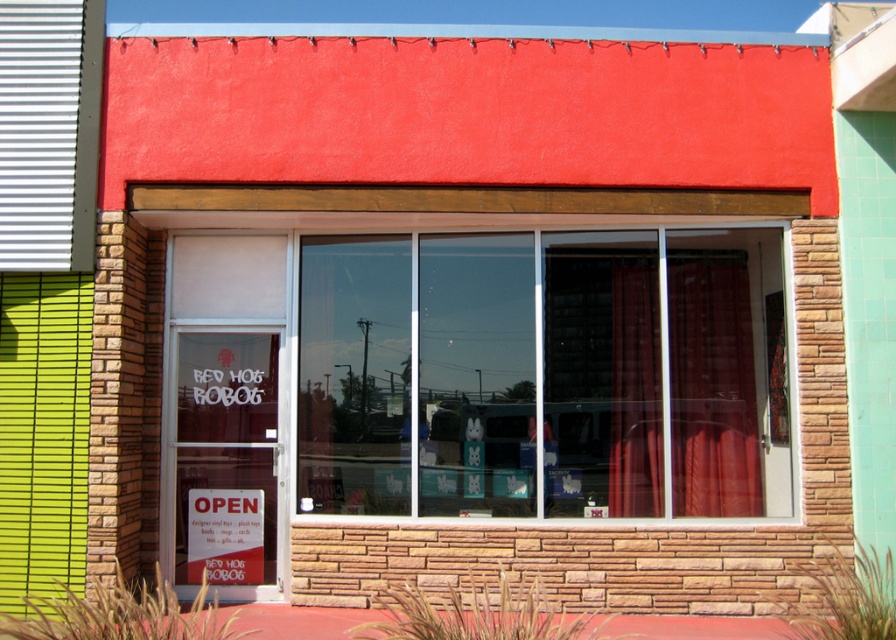
Which is more to the right, transparent glass window at center or red plastic sign at center?

Positioned to the right is transparent glass window at center.

How far apart are transparent glass window at center and red plastic sign at center?

transparent glass window at center and red plastic sign at center are 4.65 feet apart.

Is point (338, 410) less distant than point (199, 490)?

Yes, it is in front of point (199, 490).

Where is `transparent glass window at center`? The width and height of the screenshot is (896, 640). transparent glass window at center is located at coordinates (543, 374).

Does red velvet curtain at center have a smaller size compared to red plastic sign at center?

No.

Measure the distance from red velvet curtain at center to red plastic sign at center.

red velvet curtain at center and red plastic sign at center are 3.28 meters apart from each other.

Find the location of a particular element. red velvet curtain at center is located at coordinates (712, 385).

Locate an element on the screen. The image size is (896, 640). red velvet curtain at center is located at coordinates (712, 385).

Who is higher up, transparent glass window at center or red velvet curtain at center?

transparent glass window at center is higher up.

In the scene shown: Does transparent glass window at center appear over red velvet curtain at center?

Indeed, transparent glass window at center is positioned over red velvet curtain at center.

The width and height of the screenshot is (896, 640). What are the coordinates of `transparent glass window at center` in the screenshot? It's located at (543, 374).